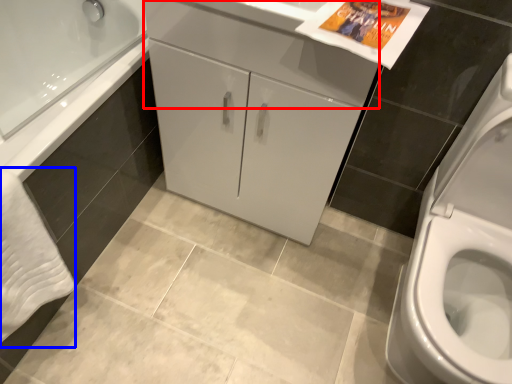
Question: Among these objects, which one is farthest to the camera, drawer (highlighted by a red box) or bath towel (highlighted by a blue box)?

Choices:
 (A) drawer
 (B) bath towel

Answer: (A)